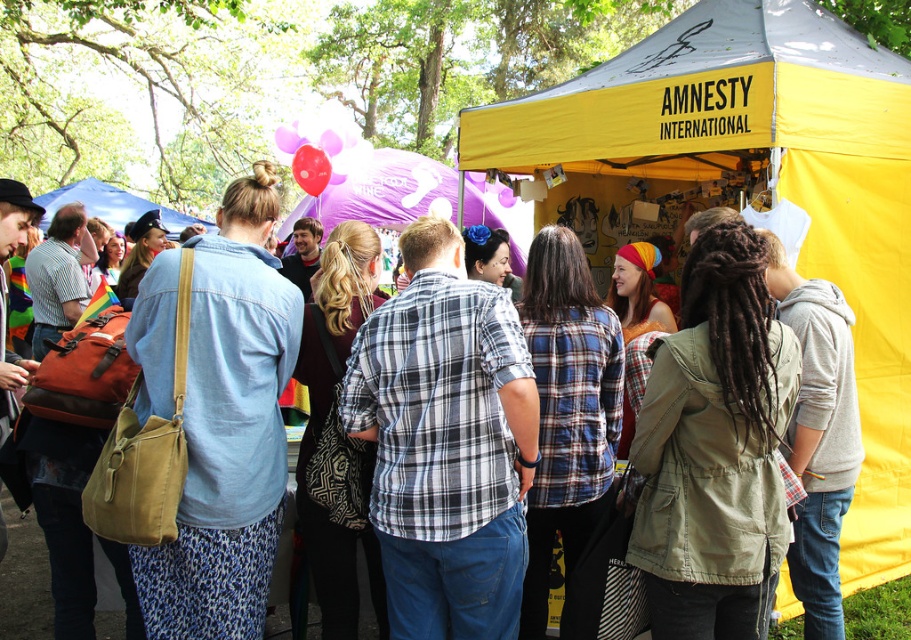
You are a photographer standing in the crowd at the festival. You want to take a photo of both the rubber balloon at upper center and the rubberized glossy balloon at center. Which balloon should you focus on first to ensure both are in the frame?

You should focus on the rubber balloon at upper center first because it is closer to you than the rubberized glossy balloon at center, ensuring both are in the frame.

You are a photographer standing at the festival and want to take a photo that includes both the point at coordinates point (367, 212) and point (140, 202). Which point will appear larger in the photo?

Point (367, 212) will appear larger in the photo because it is closer to the camera than point (140, 202).